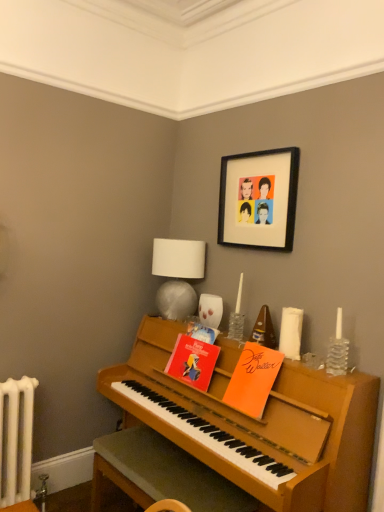
The image size is (384, 512). I want to click on free location above wooden piano bench at center (from a real-world perspective), so click(x=173, y=463).